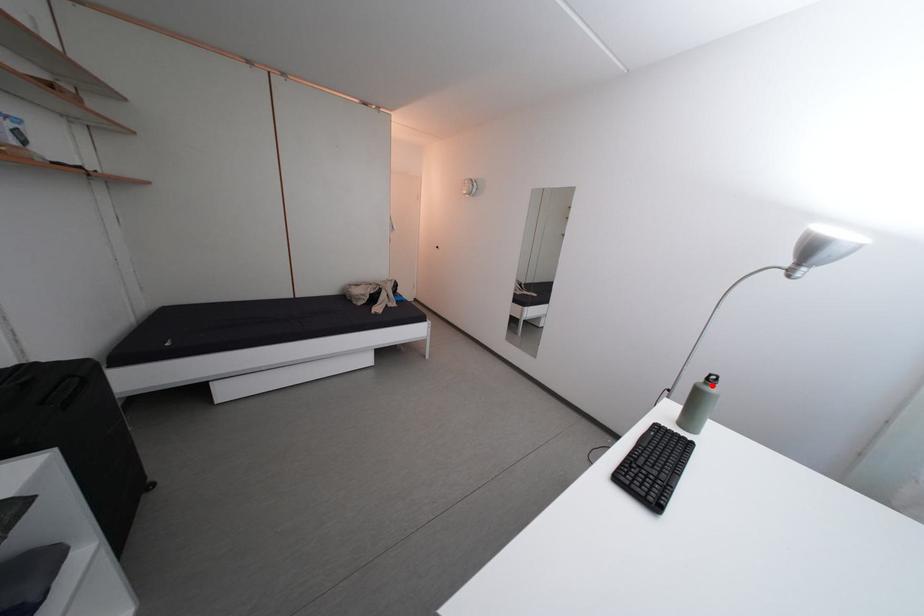
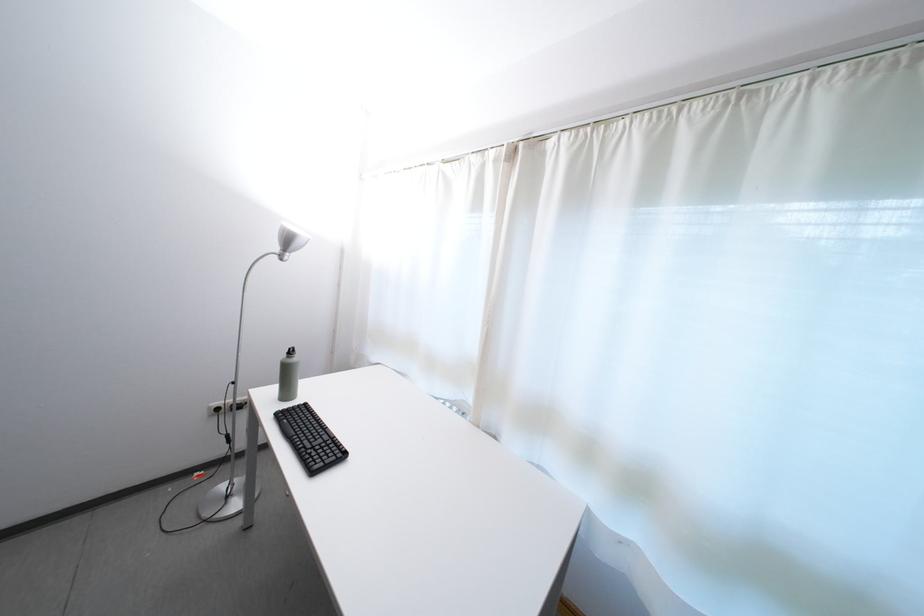
Question: I am providing you with two images of the same scene from different viewpoints. Given a red point in image1, look at the same physical point in image2. Is it:

Choices:
 (A) Closer to the viewpoint
 (B) Farther from the viewpoint

Answer: (A)